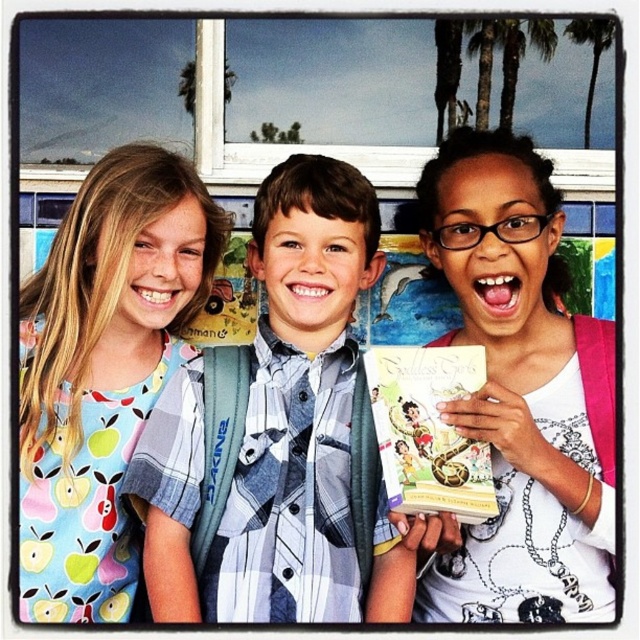
Question: Is plaid shirt at center further to camera compared to green leafy palm tree at upper right?

Choices:
 (A) no
 (B) yes

Answer: (A)

Question: Is plaid shirt at center bigger than green leafy palm tree at upper right?

Choices:
 (A) no
 (B) yes

Answer: (B)

Question: Which object is the closest to the hardcover book at center?

Choices:
 (A) printed cotton shirt at left
 (B) white glossy book at center

Answer: (B)

Question: Which of the following is the farthest from the observer?

Choices:
 (A) (38, 371)
 (B) (588, 120)
 (C) (234, 572)
 (D) (522, 364)

Answer: (B)

Question: Which point is closer to the camera taking this photo?

Choices:
 (A) (474, 340)
 (B) (189, 493)
 (C) (67, 483)

Answer: (B)

Question: Where is plaid shirt at center located in relation to white glossy book at center in the image?

Choices:
 (A) left
 (B) right

Answer: (A)